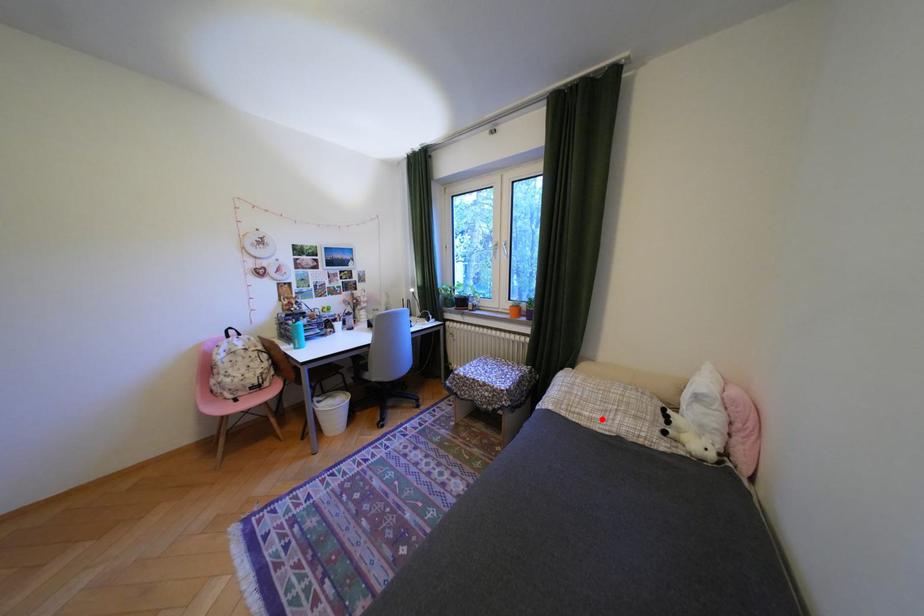
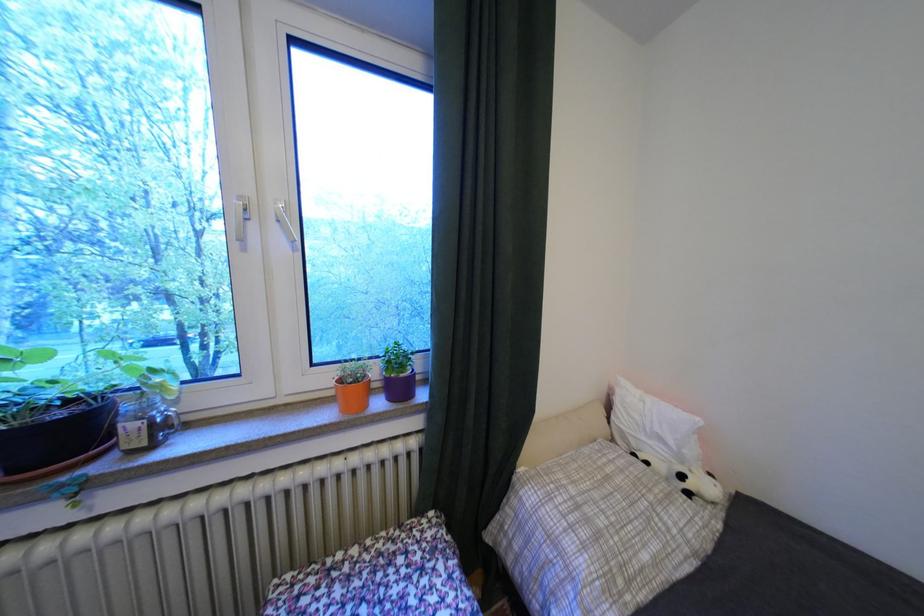
Locate, in the second image, the point that corresponds to the highlighted location in the first image.

(667, 562)